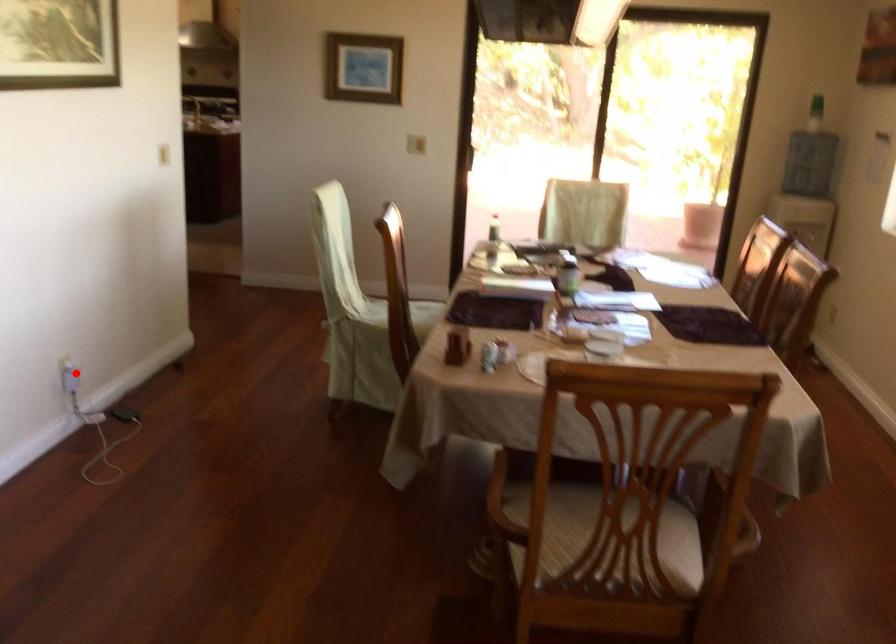
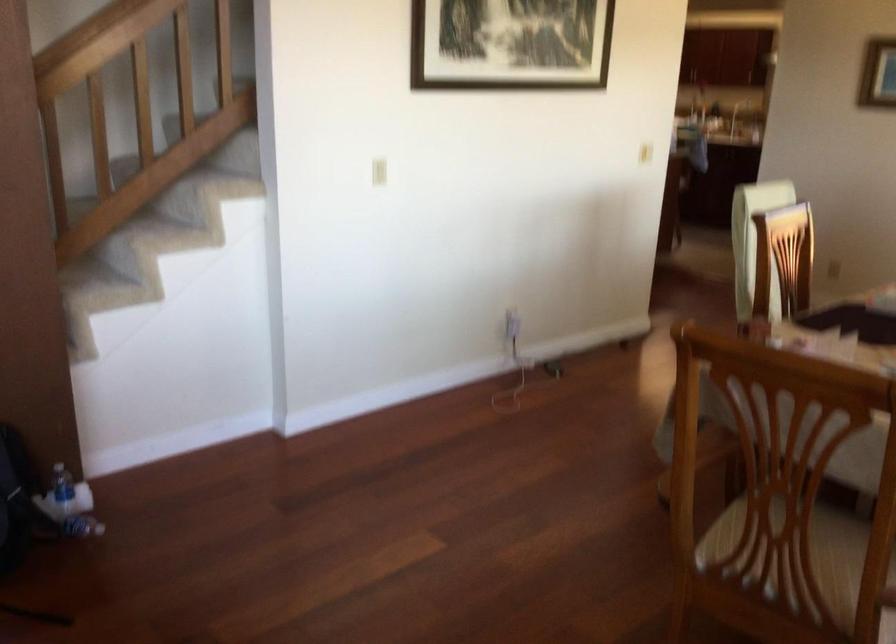
The point at the highlighted location is marked in the first image. Where is the corresponding point in the second image?

(512, 324)